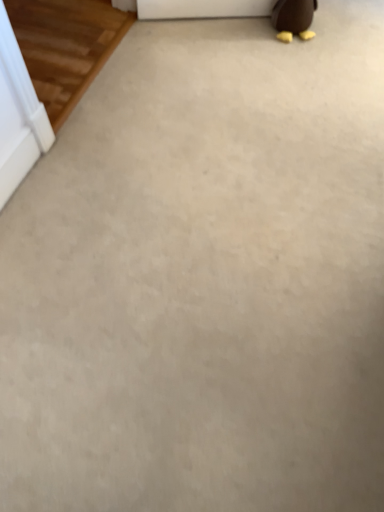
The image size is (384, 512). Describe the element at coordinates (293, 18) in the screenshot. I see `brown matte penguin at upper right` at that location.

Image resolution: width=384 pixels, height=512 pixels. Identify the location of brown matte penguin at upper right. (293, 18).

In order to face brown matte penguin at upper right, should I rotate leftwards or rightwards?

You should look right and rotate roughly 14.566 degrees.

Image resolution: width=384 pixels, height=512 pixels. Find the location of `brown matte penguin at upper right`. brown matte penguin at upper right is located at coordinates (293, 18).